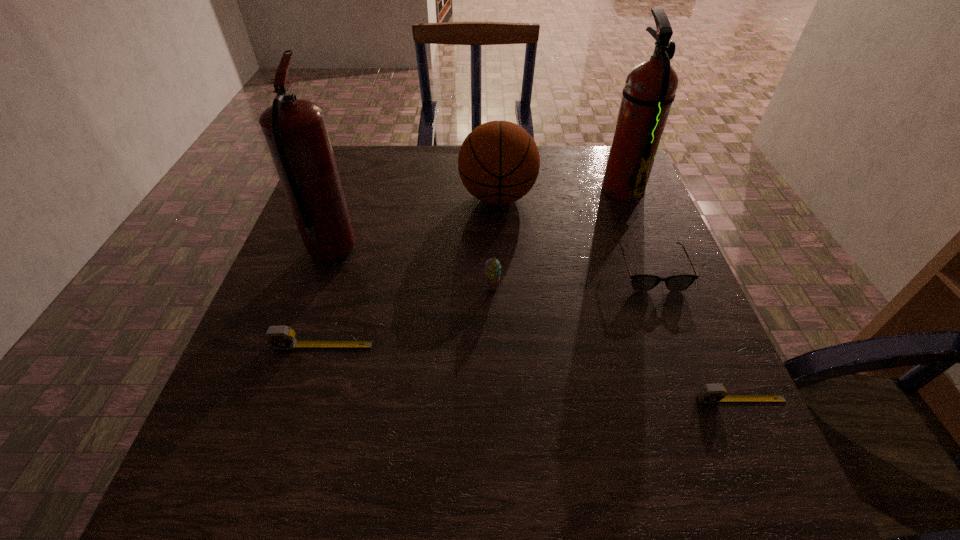
Find the location of a particular element. The width and height of the screenshot is (960, 540). vacant position for inserting another tape_measure evenly is located at coordinates (521, 371).